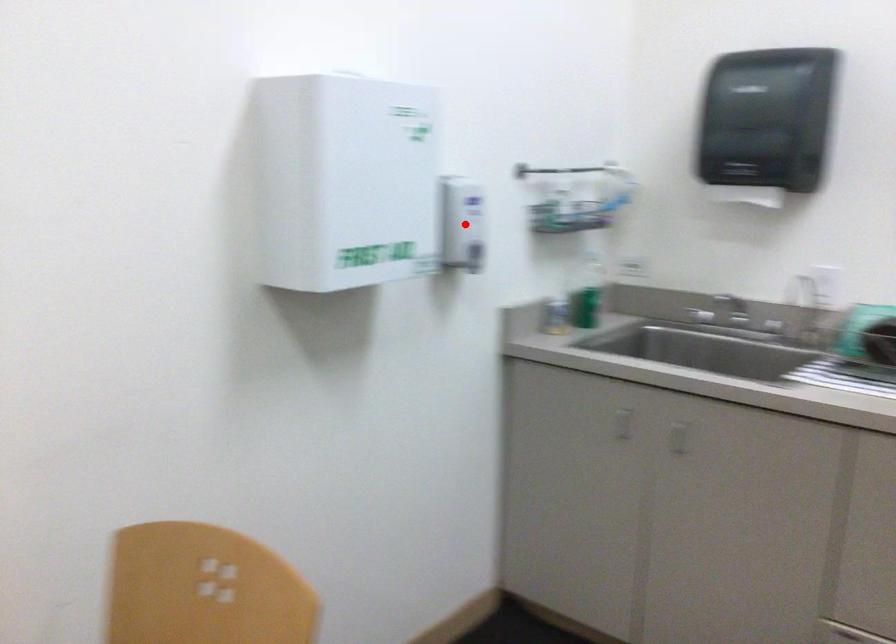
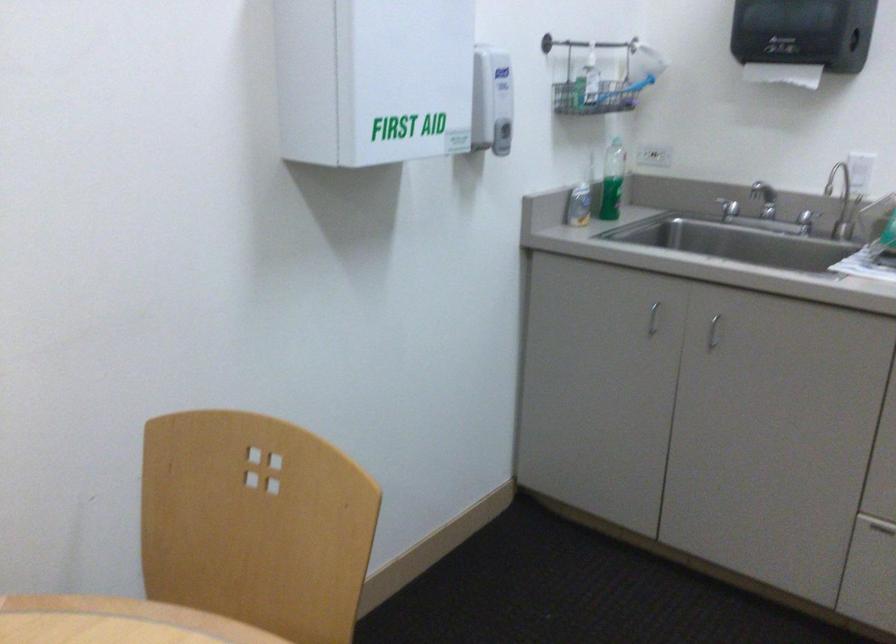
Where in the second image is the point corresponding to the highlighted location from the first image?

(492, 100)